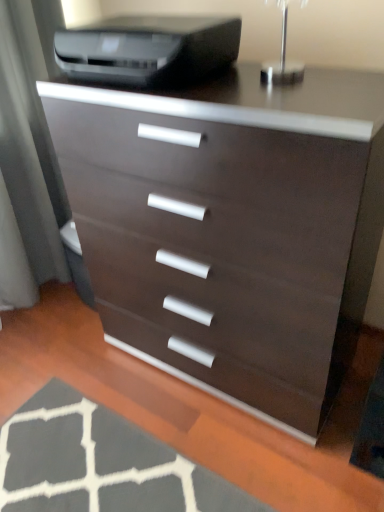
You are a GUI agent. You are given a task and a screenshot of the screen. Output one action in this format:
    pyautogui.click(x=<x>, y=<y>)
    Task: Click on the free space that is to the left of matte brown chest of drawers at center
    The image size is (384, 512).
    Given the screenshot: What is the action you would take?
    pyautogui.click(x=70, y=385)